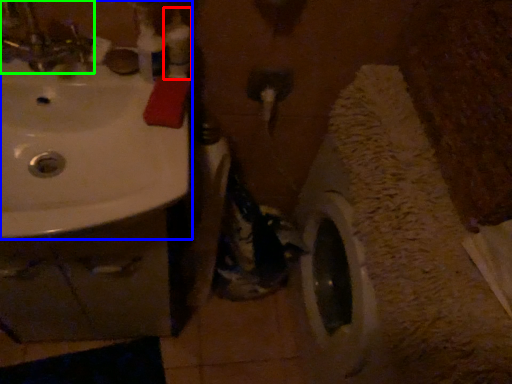
Question: Which object is the farthest from toiletry (highlighted by a red box)? Choose among these: sink (highlighted by a blue box) or tap (highlighted by a green box).

Choices:
 (A) sink
 (B) tap

Answer: (B)